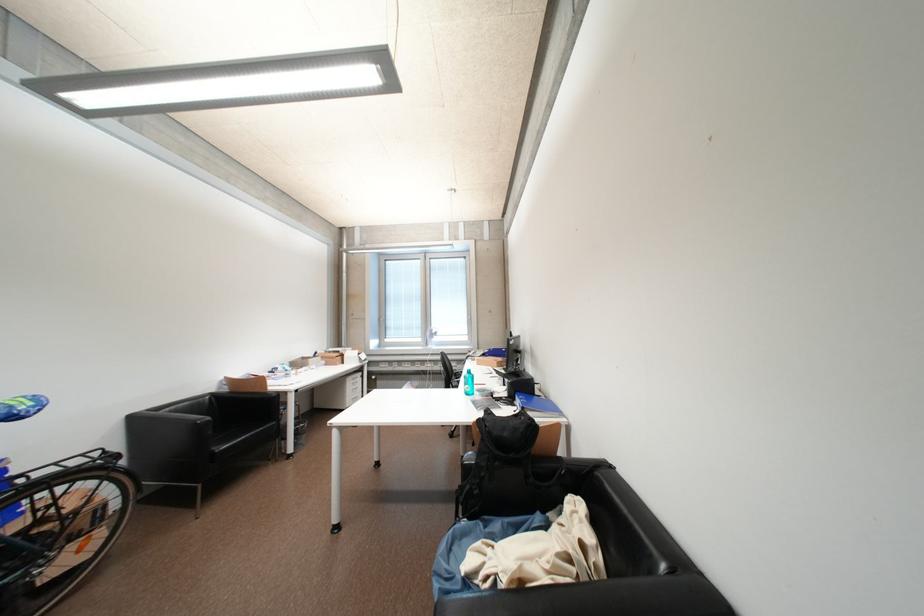
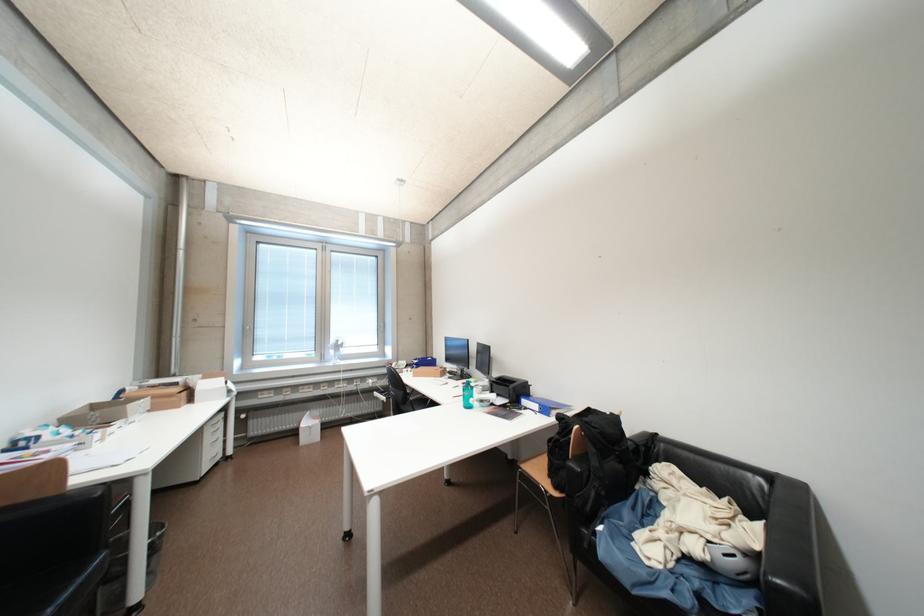
The point at (523, 408) is marked in the first image. Where is the corresponding point in the second image?

(533, 411)